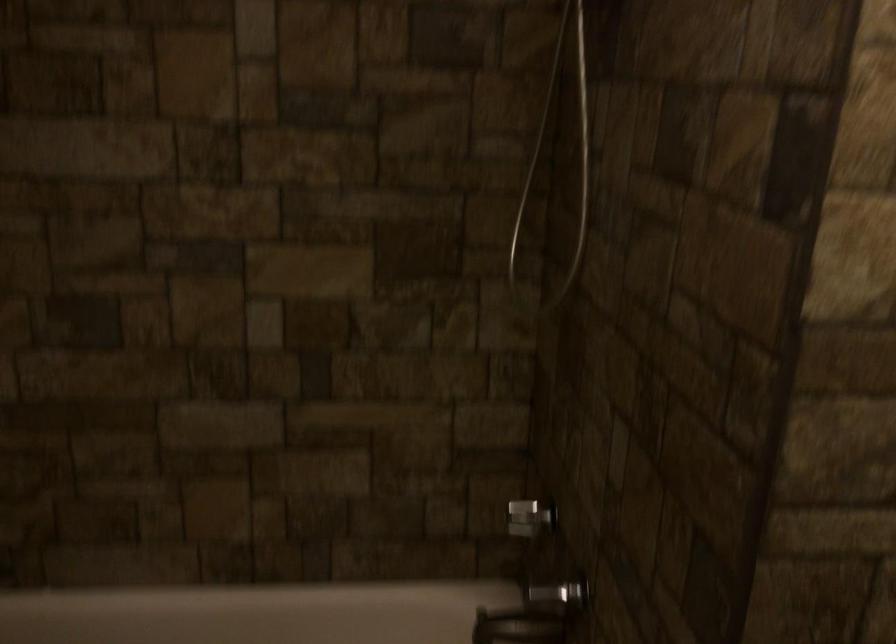
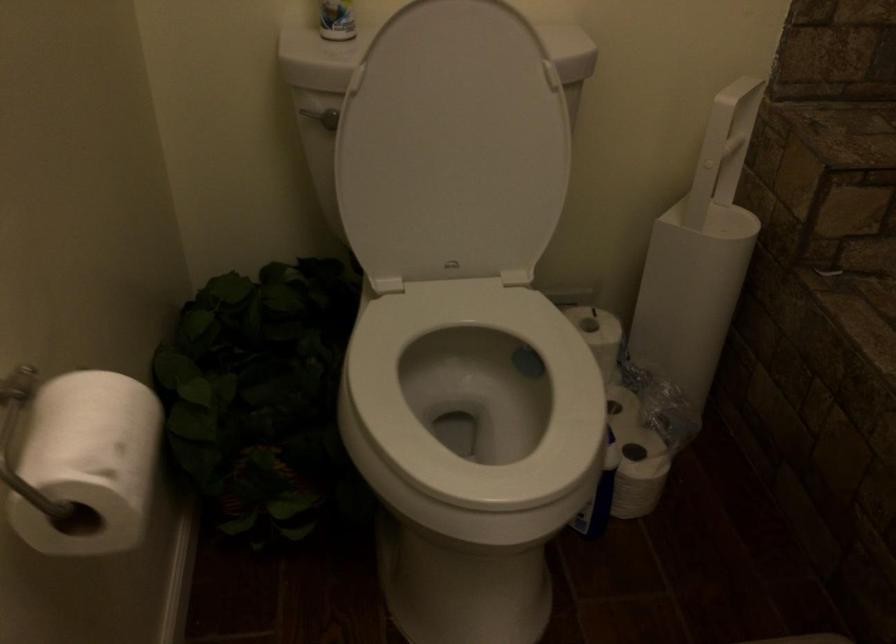
Based on the continuous images, in which direction is the camera rotating?

The camera's rotation is toward left-down.